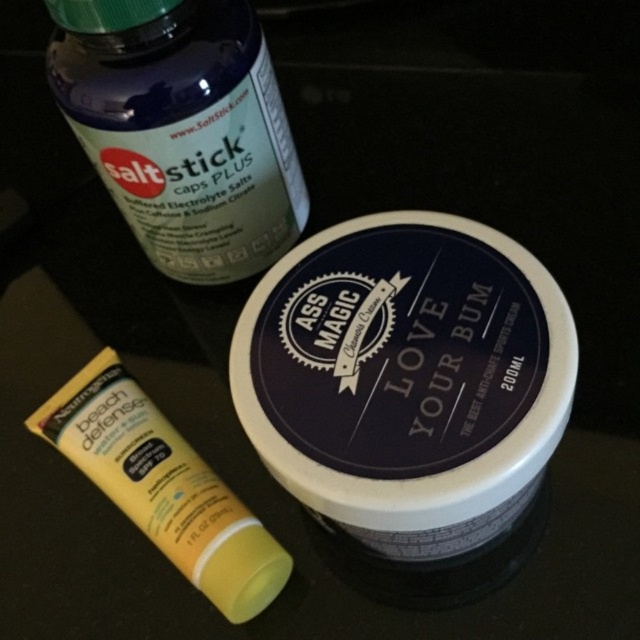
You are organizing items on a dark table. You see the translucent plastic bottle at upper left and the yellow matte tube at lower left. Which item is positioned higher on the table?

The translucent plastic bottle at upper left is positioned higher on the table than the yellow matte tube at lower left.

You are a delivery person who needs to place a package on the table. The package is 36 inches long. You see the white matte jar at center on the table. Can you fit the package next to it without moving the jar?

Answer: The white matte jar at center is 34.84 inches away from the camera, so the package is longer than the distance from the jar to the camera. Therefore, the package may not fit next to the jar without moving it.

You are organizing items on a table and need to place the translucent plastic bottle at upper left and the yellow matte tube at lower left into a vertical rack. The rack has two slots with the same height. Which item might not fit if the slots are sized for the shorter object?

The translucent plastic bottle at upper left is taller than the yellow matte tube at lower left. If the slots are sized for the shorter object, the translucent plastic bottle at upper left might not fit.